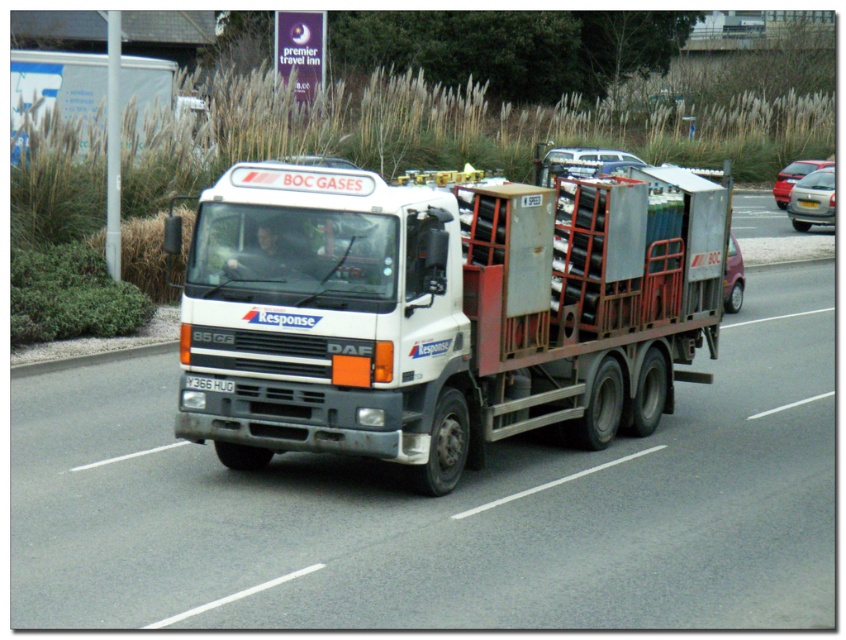
Question: Is metallic silver car at right bigger than white plastic license plate at center?

Choices:
 (A) no
 (B) yes

Answer: (B)

Question: Among these objects, which one is nearest to the camera?

Choices:
 (A) white plastic license plate at center
 (B) matte red car at right
 (C) metallic silver car at right
 (D) white matte trailer truck at center

Answer: (A)

Question: Considering the relative positions of white matte trailer truck at center and white plastic license plate at center in the image provided, where is white matte trailer truck at center located with respect to white plastic license plate at center?

Choices:
 (A) above
 (B) below

Answer: (A)

Question: Which of the following is the closest to the observer?

Choices:
 (A) (196, 376)
 (B) (204, 212)
 (C) (822, 410)

Answer: (A)

Question: Does white matte van at center appear over metallic silver car at right?

Choices:
 (A) no
 (B) yes

Answer: (A)

Question: Which of the following is the closest to the observer?

Choices:
 (A) yellow plastic license plate at center
 (B) white metallic truck at center
 (C) white matte trailer truck at center
 (D) matte red car at right

Answer: (B)